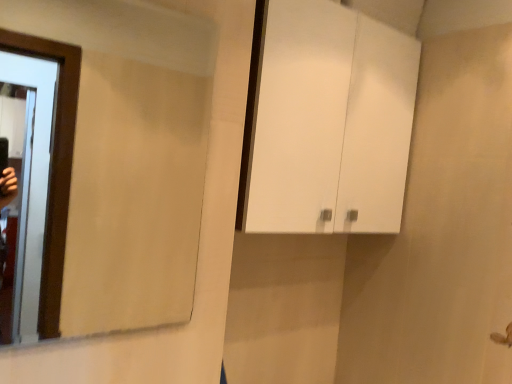
Question: Is white glossy cabinet at upper center oriented away from clear glass mirror at left?

Choices:
 (A) no
 (B) yes

Answer: (A)

Question: Is white glossy cabinet at upper center facing towards clear glass mirror at left?

Choices:
 (A) no
 (B) yes

Answer: (A)

Question: Is white glossy cabinet at upper center far away from clear glass mirror at left?

Choices:
 (A) no
 (B) yes

Answer: (B)

Question: Is white glossy cabinet at upper center shorter than clear glass mirror at left?

Choices:
 (A) yes
 (B) no

Answer: (B)

Question: Is the depth of white glossy cabinet at upper center less than that of clear glass mirror at left?

Choices:
 (A) yes
 (B) no

Answer: (B)

Question: Can you confirm if white glossy cabinet at upper center is positioned to the left of clear glass mirror at left?

Choices:
 (A) yes
 (B) no

Answer: (B)

Question: Is clear glass mirror at left surrounding white glossy cabinet at upper center?

Choices:
 (A) yes
 (B) no

Answer: (B)

Question: From a real-world perspective, is clear glass mirror at left positioned under white glossy cabinet at upper center based on gravity?

Choices:
 (A) yes
 (B) no

Answer: (A)

Question: Considering the relative sizes of clear glass mirror at left and white glossy cabinet at upper center in the image provided, is clear glass mirror at left taller than white glossy cabinet at upper center?

Choices:
 (A) yes
 (B) no

Answer: (B)

Question: Is clear glass mirror at left beside white glossy cabinet at upper center?

Choices:
 (A) no
 (B) yes

Answer: (A)

Question: Does clear glass mirror at left come behind white glossy cabinet at upper center?

Choices:
 (A) no
 (B) yes

Answer: (A)

Question: From the image's perspective, is clear glass mirror at left located beneath white glossy cabinet at upper center?

Choices:
 (A) no
 (B) yes

Answer: (B)

Question: Is point (163, 144) closer or farther from the camera than point (342, 122)?

Choices:
 (A) closer
 (B) farther

Answer: (B)